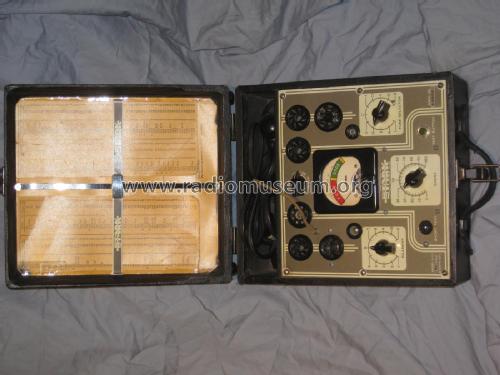
This screenshot has height=375, width=500. In order to click on cord in this screenshot , I will do `click(258, 213)`.